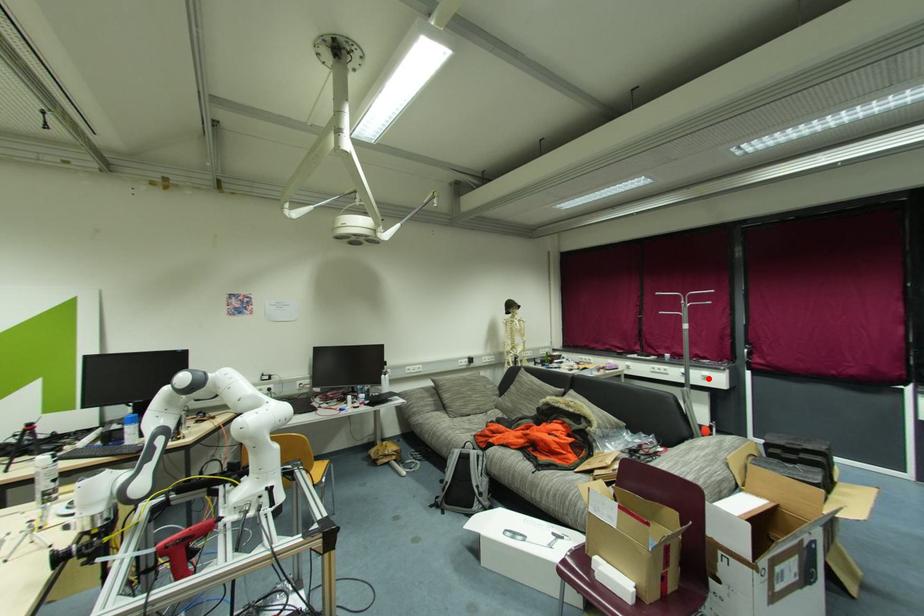
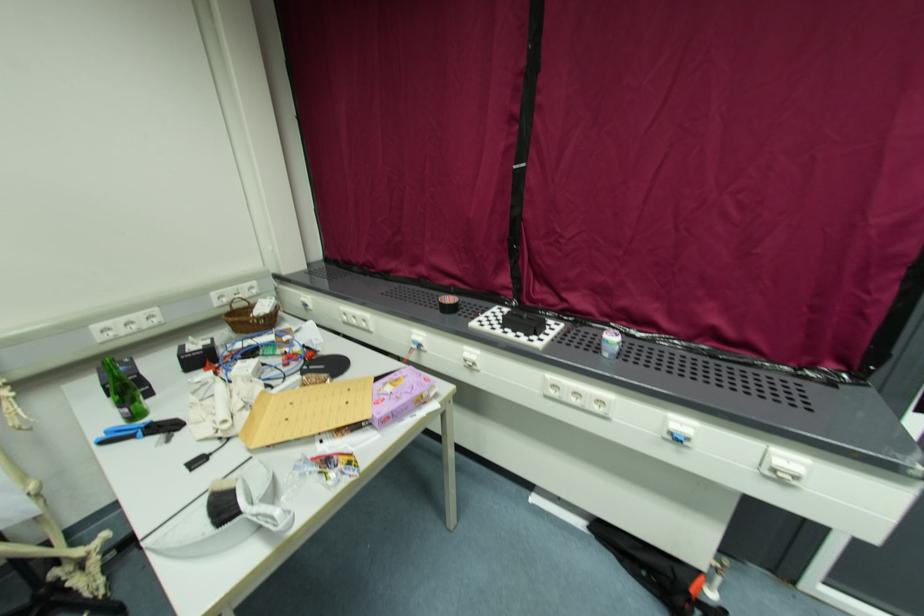
The point at the highlighted location is marked in the first image. Where is the corresponding point in the second image?

(783, 477)